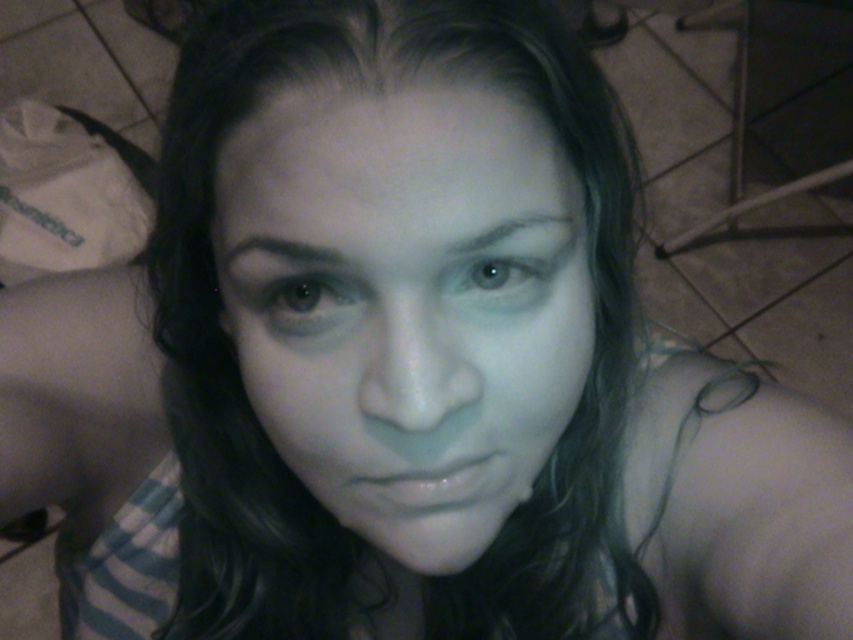
You are a photographer adjusting the lighting in this dimly lit room. You notice the brown matte eye at center and the blue glossy eye at center. Which eye is positioned to the left in the image?

The brown matte eye at center is positioned to the left of the blue glossy eye at center.

You are a photographer trying to adjust the lighting for a closeup portrait. The subject has a smooth skin face at center. You notice that the lighting is uneven, casting shadows. To ensure even lighting, you need to know the distance between the subject and the camera. Can you determine if the distance is sufficient for proper lighting adjustment?

The subject and the camera are 11.61 inches apart. This distance may be too close for proper lighting adjustment as most portrait lighting setups require a minimum distance of about 12 inches to avoid harsh shadows and ensure even illumination.

In the dimly lit indoor selfie, you notice the gray matte eyebrow at upper center and the dark brown hair at upper center. Which of these two features appears larger in the photo?

The gray matte eyebrow at upper center is bigger than the dark brown hair at upper center in the photo.